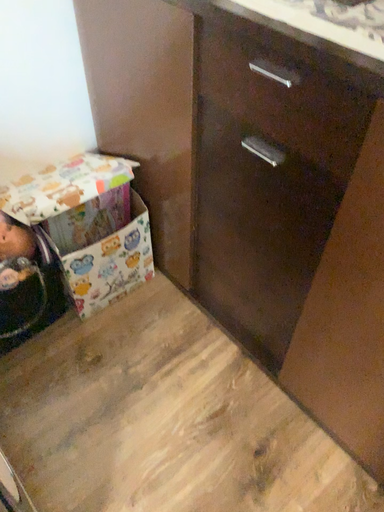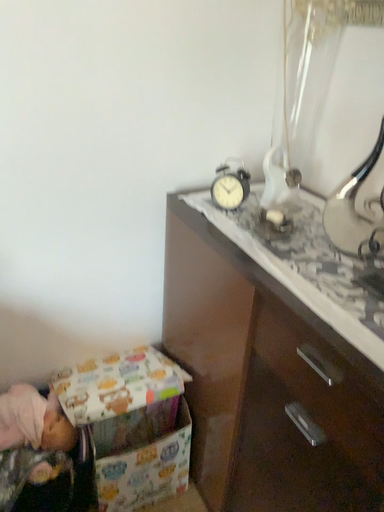
Question: How did the camera likely rotate when shooting the video?

Choices:
 (A) rotated right
 (B) rotated left

Answer: (B)